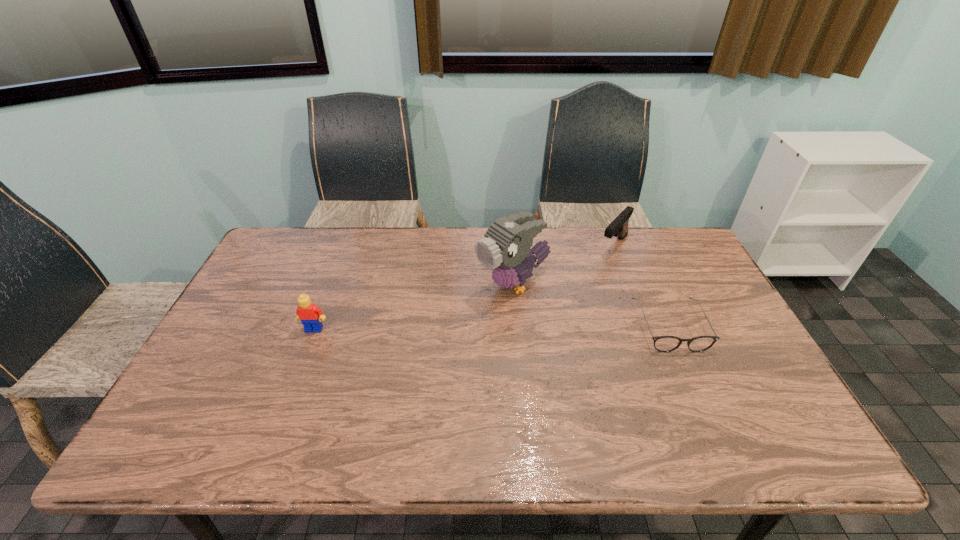
Where is `free spot between the spectacles and the bird`? free spot between the spectacles and the bird is located at coordinates click(x=591, y=306).

The image size is (960, 540). What are the coordinates of `free area in between the spectacles and the Lego` in the screenshot? It's located at (492, 328).

I want to click on object that ranks as the third closest to the shortest object, so click(x=310, y=315).

Locate which object ranks in proximity to the farthest object. Please provide its 2D coordinates. Your answer should be formatted as a tuple, i.e. [(x, y)], where the tuple contains the x and y coordinates of a point satisfying the conditions above.

[(506, 249)]